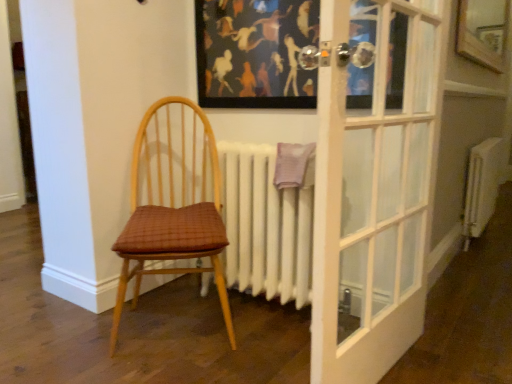
Question: Is white matte radiator at center, which ranks as the 1th radiator in front-to-back order, wider than wooden chair with woven seat cushion at left?

Choices:
 (A) yes
 (B) no

Answer: (B)

Question: Considering the relative positions of white matte radiator at center, the 2th radiator from the back, and wooden chair with woven seat cushion at left in the image provided, is white matte radiator at center, the 2th radiator from the back, behind wooden chair with woven seat cushion at left?

Choices:
 (A) no
 (B) yes

Answer: (B)

Question: Is white matte radiator at center, which ranks as the 1th radiator in front-to-back order, positioned in front of wooden chair with woven seat cushion at left?

Choices:
 (A) yes
 (B) no

Answer: (B)

Question: Could you tell me if white matte radiator at center, the 2th radiator from the back, is turned towards wooden chair with woven seat cushion at left?

Choices:
 (A) no
 (B) yes

Answer: (B)

Question: Would you say white matte radiator at center, the 2th radiator from the back, contains wooden chair with woven seat cushion at left?

Choices:
 (A) yes
 (B) no

Answer: (B)

Question: Is wooden frame at upper right inside the boundaries of wooden chair with woven seat cushion at left, or outside?

Choices:
 (A) outside
 (B) inside

Answer: (A)

Question: In terms of width, does wooden frame at upper right look wider or thinner when compared to wooden chair with woven seat cushion at left?

Choices:
 (A) thin
 (B) wide

Answer: (A)

Question: From a real-world perspective, is wooden frame at upper right physically located above or below wooden chair with woven seat cushion at left?

Choices:
 (A) below
 (B) above

Answer: (B)

Question: Considering the relative positions of wooden frame at upper right and wooden chair with woven seat cushion at left in the image provided, is wooden frame at upper right to the left or to the right of wooden chair with woven seat cushion at left?

Choices:
 (A) right
 (B) left

Answer: (A)

Question: In the image, is wooden frame at upper right on the left side or the right side of white metallic radiator at right, which is the 1th radiator in back-to-front order?

Choices:
 (A) right
 (B) left

Answer: (B)

Question: From the image's perspective, is wooden frame at upper right located above or below white metallic radiator at right, marked as the first radiator in a right-to-left arrangement?

Choices:
 (A) below
 (B) above

Answer: (B)

Question: From a real-world perspective, is wooden frame at upper right positioned above or below white metallic radiator at right, which ranks as the 2th radiator in front-to-back order?

Choices:
 (A) below
 (B) above

Answer: (B)

Question: In terms of height, does wooden frame at upper right look taller or shorter compared to white metallic radiator at right, which is the 1th radiator in back-to-front order?

Choices:
 (A) tall
 (B) short

Answer: (B)

Question: Is wooden frame at upper right taller or shorter than matte black picture frame at upper center?

Choices:
 (A) tall
 (B) short

Answer: (A)

Question: Is wooden frame at upper right to the left or to the right of matte black picture frame at upper center in the image?

Choices:
 (A) left
 (B) right

Answer: (B)